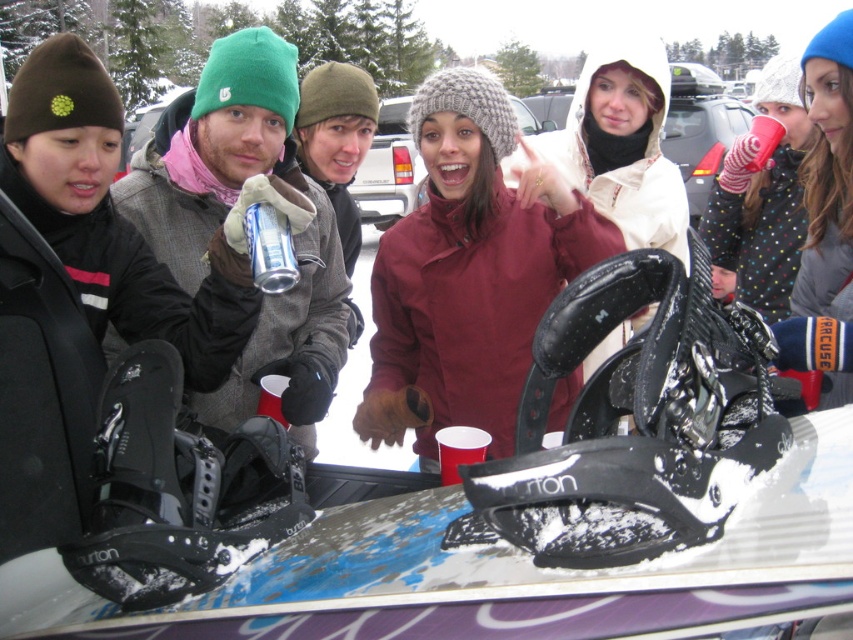
Can you confirm if maroon fabric jacket at center is shorter than matte gray snowboard at center?

In fact, maroon fabric jacket at center may be taller than matte gray snowboard at center.

Does maroon fabric jacket at center have a greater width compared to matte gray snowboard at center?

Yes, maroon fabric jacket at center is wider than matte gray snowboard at center.

Does point (402, 280) lie in front of point (288, 140)?

No, it is behind (288, 140).

In order to click on maroon fabric jacket at center in this screenshot , I will do `click(468, 273)`.

Does maroon fabric jacket at center appear over silver metallic can at center?

No.

The width and height of the screenshot is (853, 640). What are the coordinates of `maroon fabric jacket at center` in the screenshot? It's located at (468, 273).

Is point (126, 198) closer to camera compared to point (105, 296)?

No, (126, 198) is behind (105, 296).

Between matte gray snowboard at center and matte green beanie at left, which one is positioned higher?

matte gray snowboard at center

This screenshot has width=853, height=640. I want to click on matte gray snowboard at center, so click(238, 209).

Where is `matte gray snowboard at center`? The width and height of the screenshot is (853, 640). matte gray snowboard at center is located at coordinates (238, 209).